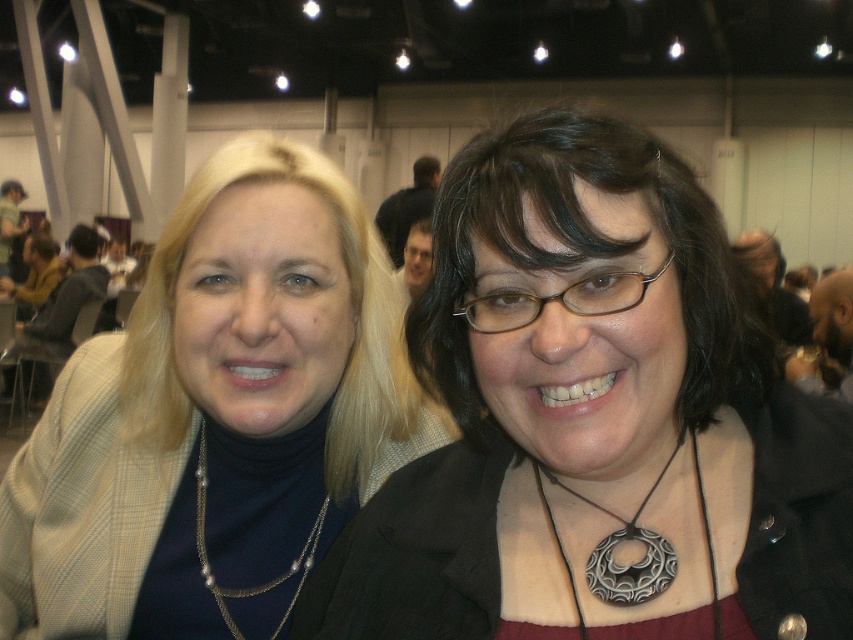
You are standing at the camera position and want to reach the point marked at coordinates point (x=625, y=147). If you take a step forward of 20 inches, will you be able to reach that point?

Yes, because the point (x=625, y=147) is 20.25 inches away from the camera, so stepping forward 20 inches will bring you close enough to reach it.